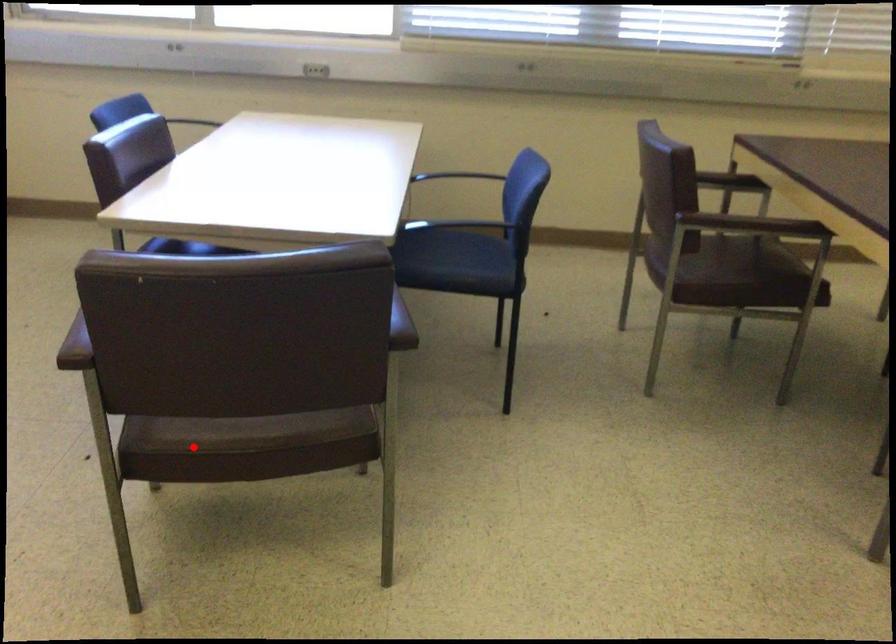
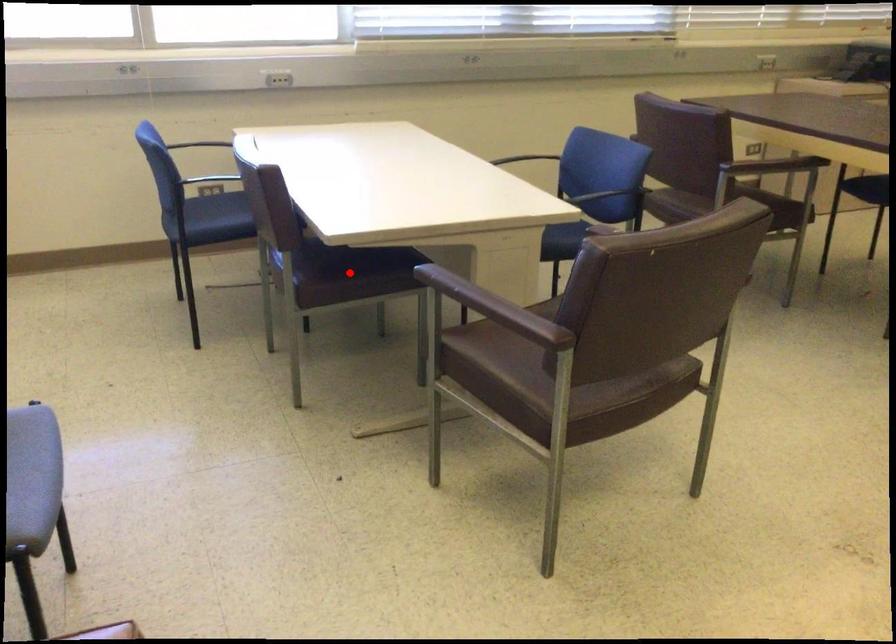
I am providing you with two images of the same scene from different viewpoints. A red point is marked on the first image and another point is marked on the second image. Does the point marked in image1 correspond to the same location as the one in image2?

No